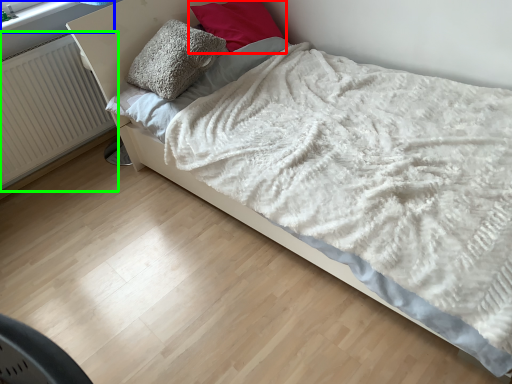
Question: Which object is positioned farthest from pillow (highlighted by a red box)? Select from window frame (highlighted by a blue box) and radiator (highlighted by a green box).

Choices:
 (A) window frame
 (B) radiator

Answer: (B)